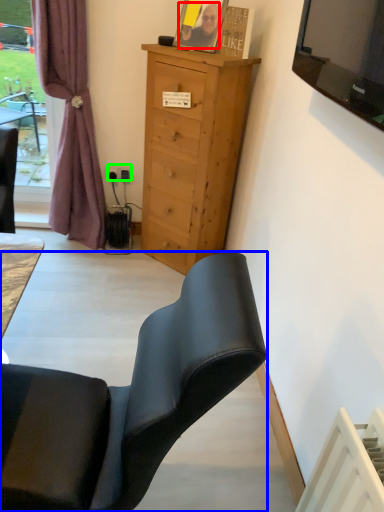
Question: Which is nearer to the person (highlighted by a red box)? chair (highlighted by a blue box) or power outlet (highlighted by a green box).

Choices:
 (A) chair
 (B) power outlet

Answer: (B)